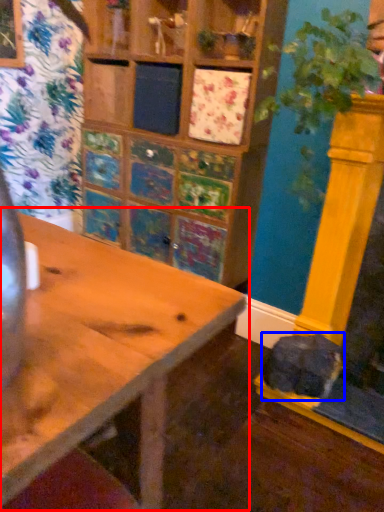
Question: Which object appears farthest to the camera in this image, table (highlighted by a red box) or animal (highlighted by a blue box)?

Choices:
 (A) table
 (B) animal

Answer: (B)